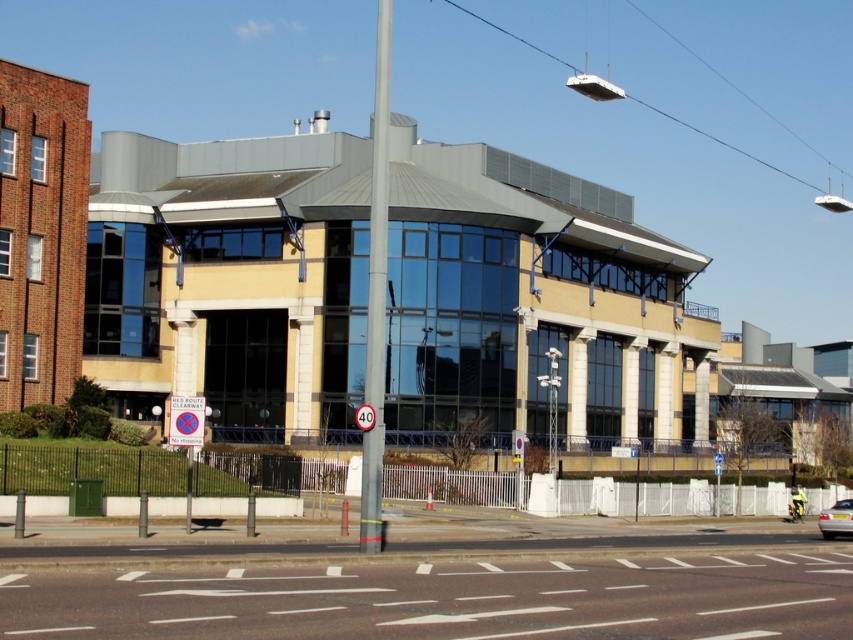
You are standing at the entrance of the modern building and want to locate the metallic pole at center. Based on the coordinates provided, where would you find it?

The metallic pole at center is located at coordinates point [376,292].